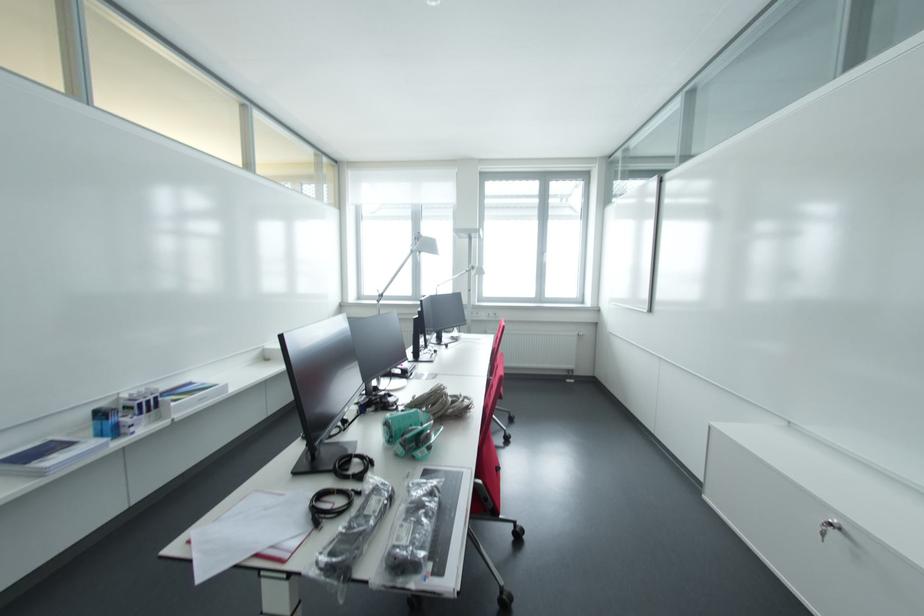
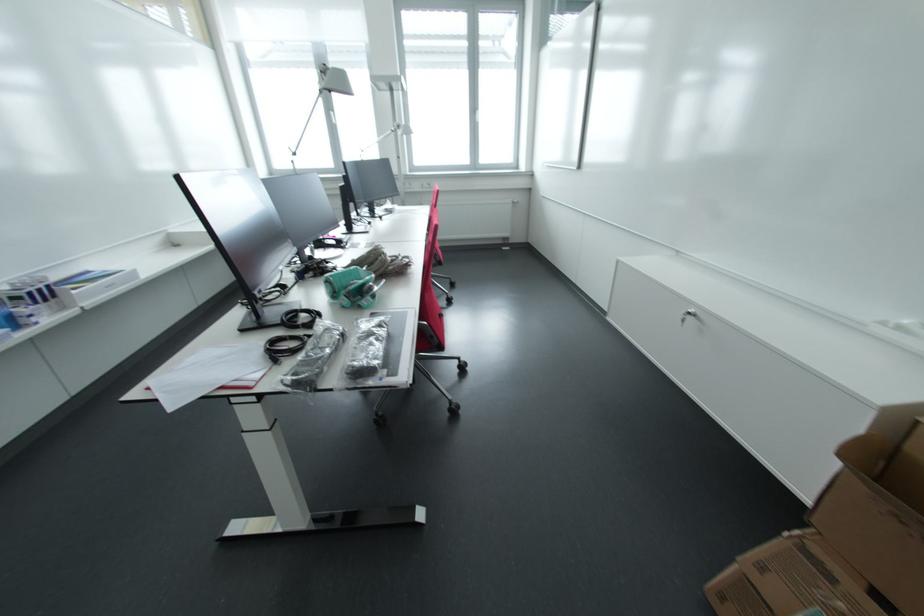
The point at (x=414, y=220) is marked in the first image. Where is the corresponding point in the second image?

(319, 67)